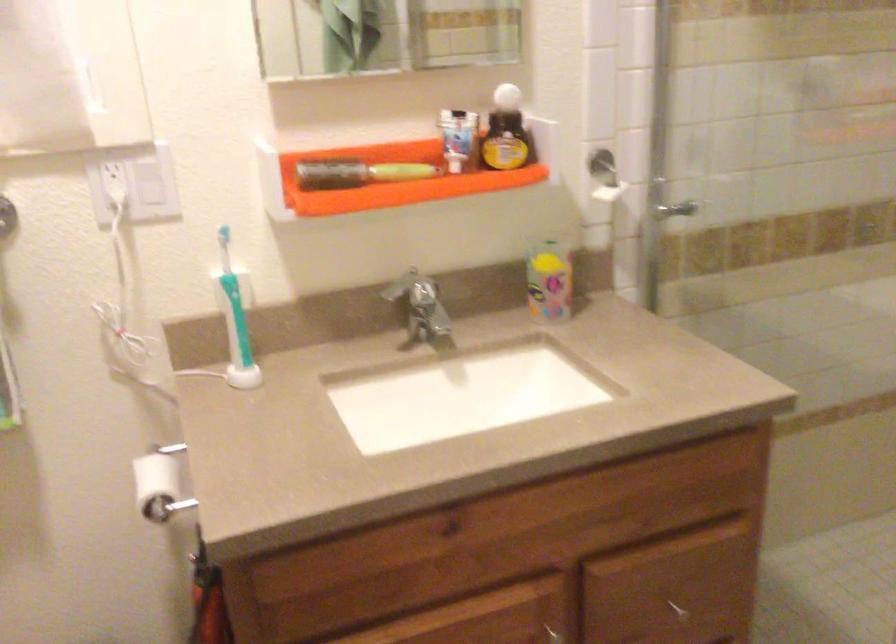
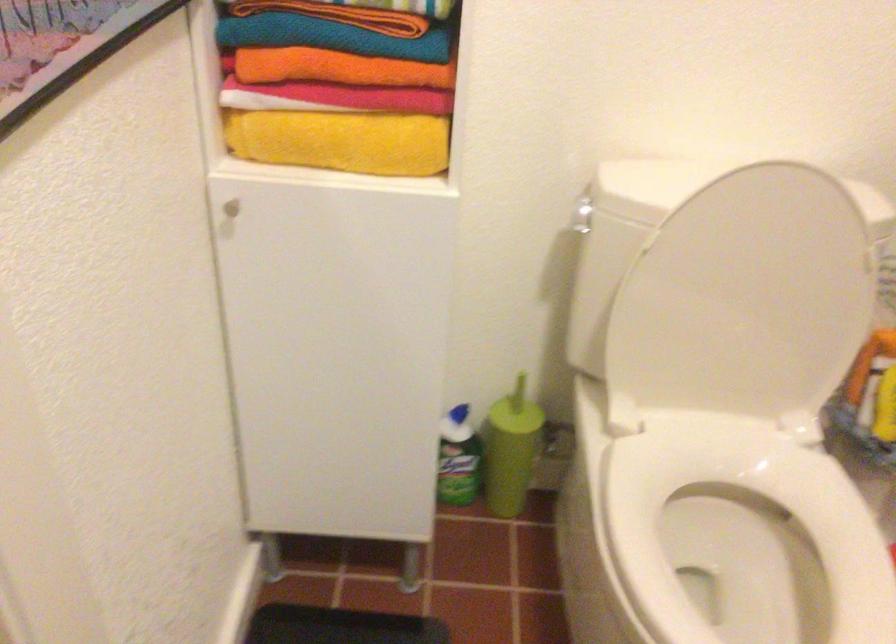
How did the camera likely rotate?

The rotation direction of the camera is left-down.